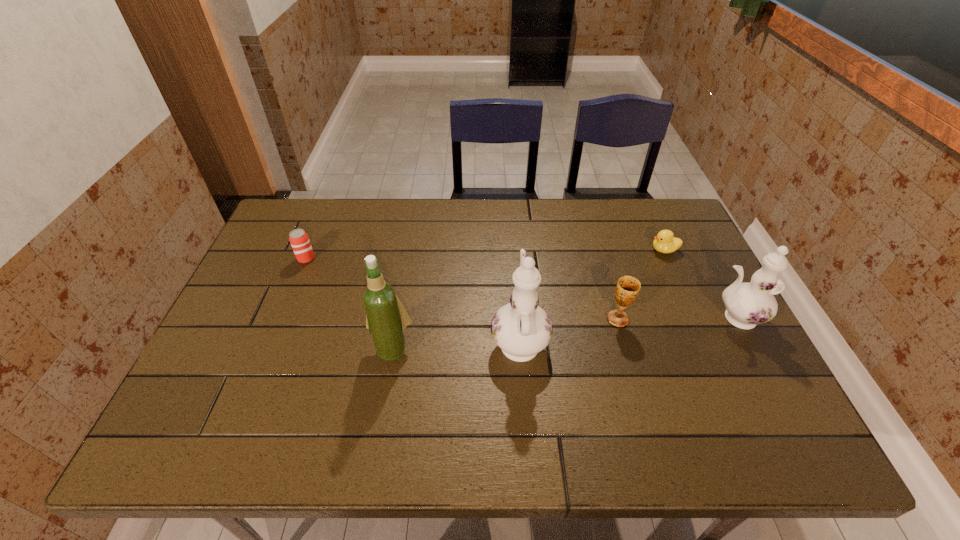
This screenshot has height=540, width=960. Identify the location of free space located 0.090m on the right of the third shortest object. (662, 319).

This screenshot has height=540, width=960. I want to click on vacant space located 0.100m on the left of the leftmost object, so click(265, 259).

Identify the location of object present at the far edge. Image resolution: width=960 pixels, height=540 pixels. (665, 242).

The height and width of the screenshot is (540, 960). I want to click on object at the left edge, so click(299, 240).

At what (x,y) coordinates should I click in order to perform the action: click on chinaware present at the right edge. Please return your answer as a coordinate pair (x, y). Looking at the image, I should click on (747, 304).

I want to click on duckling present at the right edge, so click(665, 242).

You are a GUI agent. You are given a task and a screenshot of the screen. Output one action in this format:
    pyautogui.click(x=<x>, y=<y>)
    Task: Click on the object that is at the far right corner
    The image size is (960, 540).
    Given the screenshot: What is the action you would take?
    pyautogui.click(x=665, y=242)

In order to click on vacant region at the far edge of the desktop in this screenshot , I will do `click(620, 216)`.

Find the location of a particular element. The height and width of the screenshot is (540, 960). vacant area at the near edge is located at coordinates (667, 390).

You are a GUI agent. You are given a task and a screenshot of the screen. Output one action in this format:
    pyautogui.click(x=<x>, y=<y>)
    Task: Click on the free point at the left edge
    This screenshot has width=960, height=540.
    Given the screenshot: What is the action you would take?
    pyautogui.click(x=292, y=266)